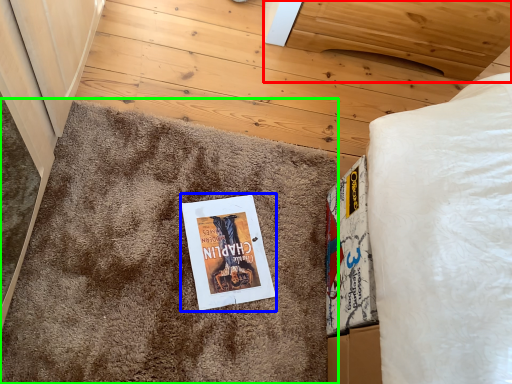
Question: Which object is positioned closest to furniture (highlighted by a red box)? Select from fiction book (highlighted by a blue box) and doormat (highlighted by a green box).

Choices:
 (A) fiction book
 (B) doormat

Answer: (B)